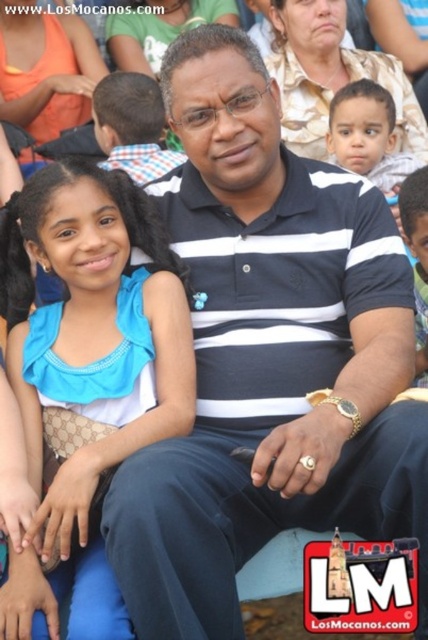
Measure the distance from smooth skin baby at upper right to smooth skin face at center.

smooth skin baby at upper right is 2.07 meters from smooth skin face at center.

Describe the element at coordinates (368, 134) in the screenshot. I see `smooth skin baby at upper right` at that location.

Where is `smooth skin baby at upper right`? This screenshot has width=428, height=640. smooth skin baby at upper right is located at coordinates (368, 134).

Locate an element on the screen. blue satin dress at left is located at coordinates (92, 328).

What do you see at coordinates (92, 328) in the screenshot?
I see `blue satin dress at left` at bounding box center [92, 328].

Is point (160, 253) positioned in front of point (392, 145)?

Yes.

Where is `blue satin dress at left`? The image size is (428, 640). blue satin dress at left is located at coordinates (92, 328).

Which is behind, point (23, 387) or point (425, 212)?

The point (425, 212) is more distant.

Describe the element at coordinates (92, 328) in the screenshot. I see `blue satin dress at left` at that location.

What are the coordinates of `blue satin dress at left` in the screenshot? It's located at (92, 328).